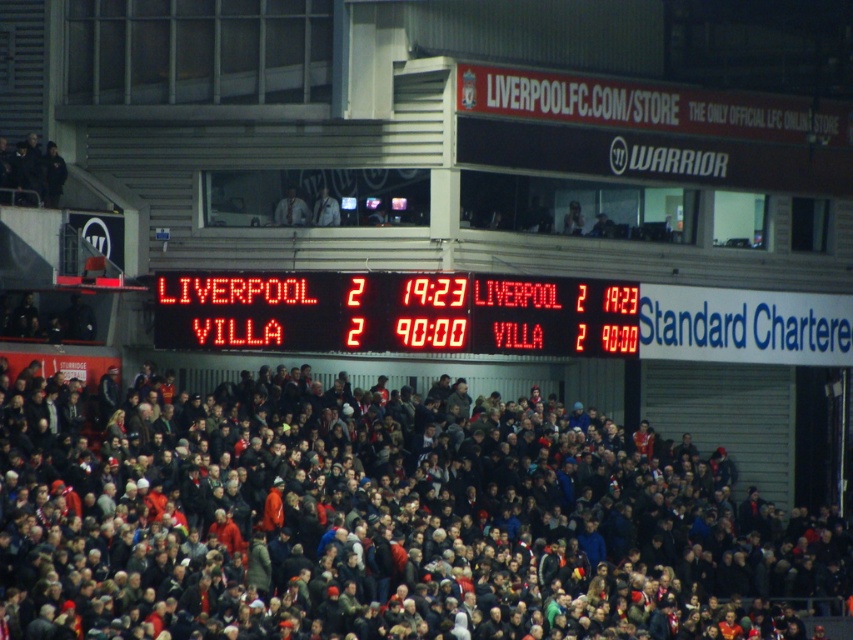
You are a photographer at Anfield stadium and want to capture a photo of the red led scoreboard at center and the dark gray crowd at center. Based on their positions, which one should you focus on first if you want to include both in your shot?

The dark gray crowd at center is positioned under the red led scoreboard at center, so you should focus on the red led scoreboard at center first as it is higher up and then adjust to capture the crowd below.

You are a photographer at Anfield stadium and want to capture a photo that highlights both the dark gray crowd at center and the red led scoreboard at center. Given their sizes, which object should you focus on first to ensure both are clearly visible in the frame?

The dark gray crowd at center is larger in size than the red led scoreboard at center, so you should focus on the dark gray crowd at center first to ensure both are clearly visible in the frame.